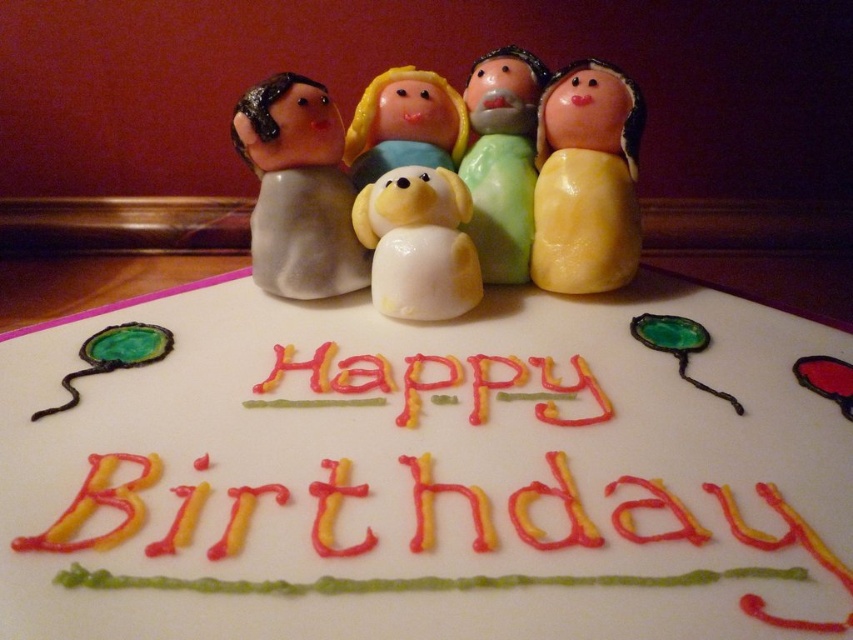
You are planning to place a candle at the exact center of the cake. The yellow matte figurine at center is located at point [585,180]. Where should you place the candle relative to this figurine?

The candle should be placed at the exact center of the cake, which is different from the yellow matte figurine at center located at point [585,180]. Therefore, you should move the candle away from the figurine to the true center of the cake.

Consider the image. You are a birthday guest looking at the cake. Where is the white glossy dog at center located on the cake?

The white glossy dog at center is located at the center of the cake, specifically at the 2D coordinates point (418, 243).

You are standing in front of the birthday cake and want to place a candle at the point marked as point (273, 243). If the candle is 12 inches long, will it fit vertically on the cake without touching the table?

The point (273, 243) is 30.72 inches away from the camera. Since the candle is only 12 inches long, it will fit vertically on the cake without touching the table.